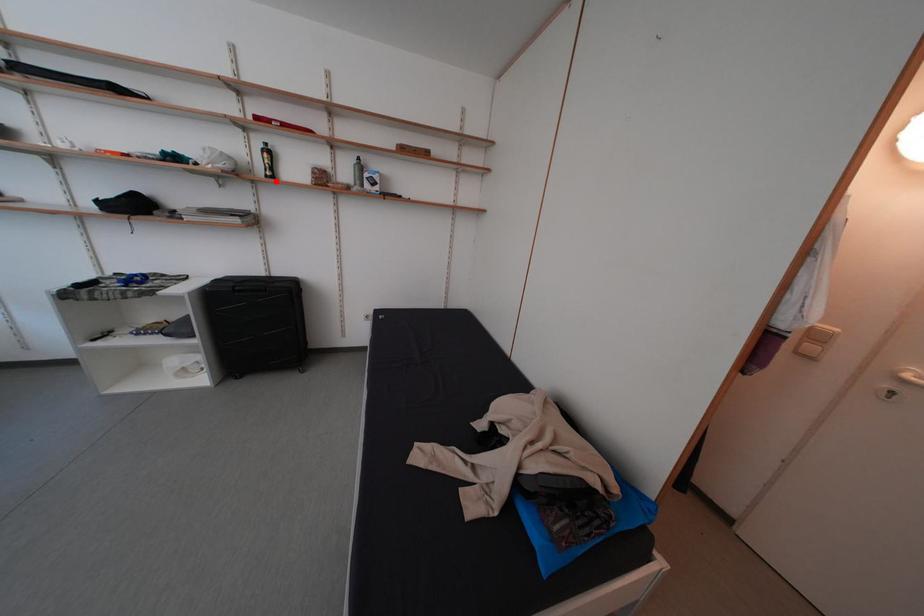
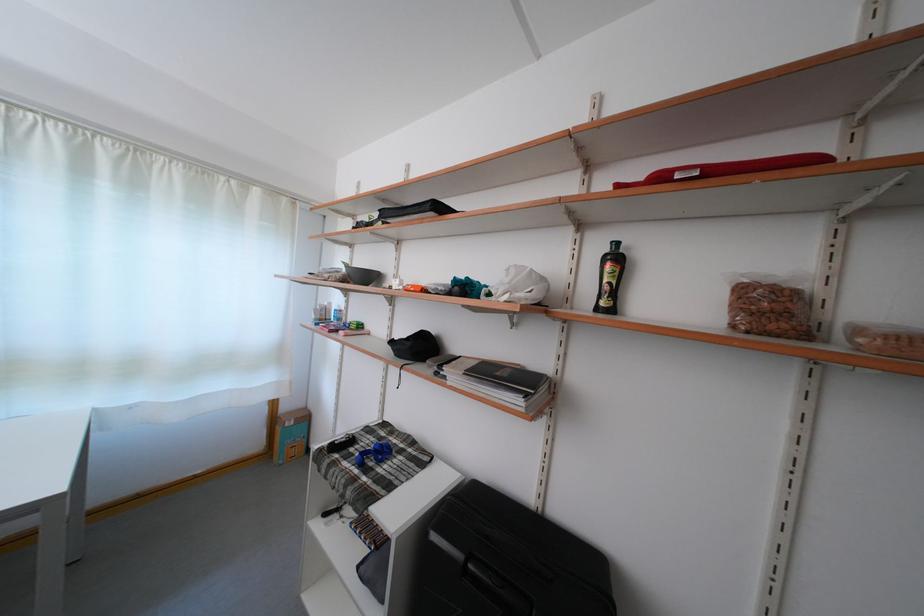
Where in the second image is the point corresponding to the highlighted location from the first image?

(606, 314)